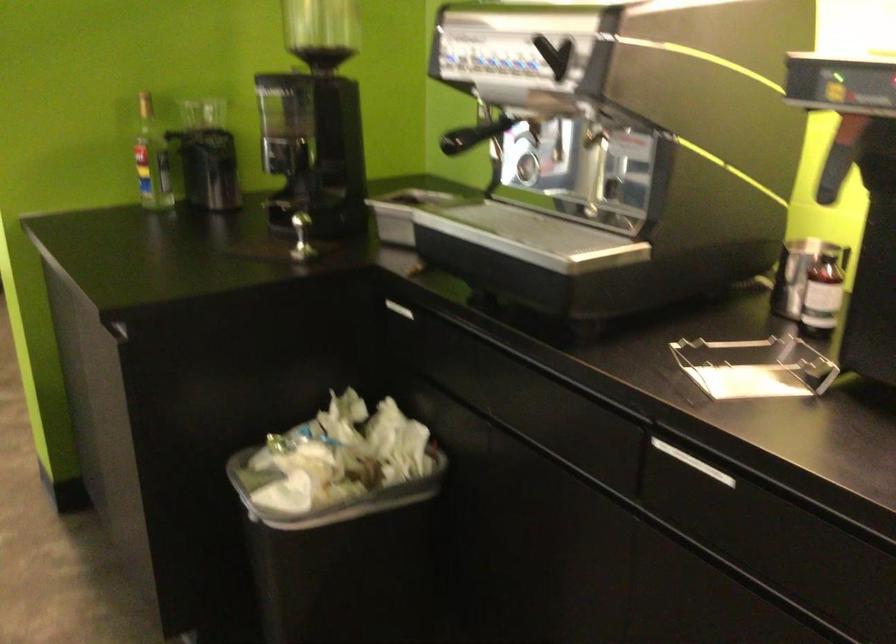
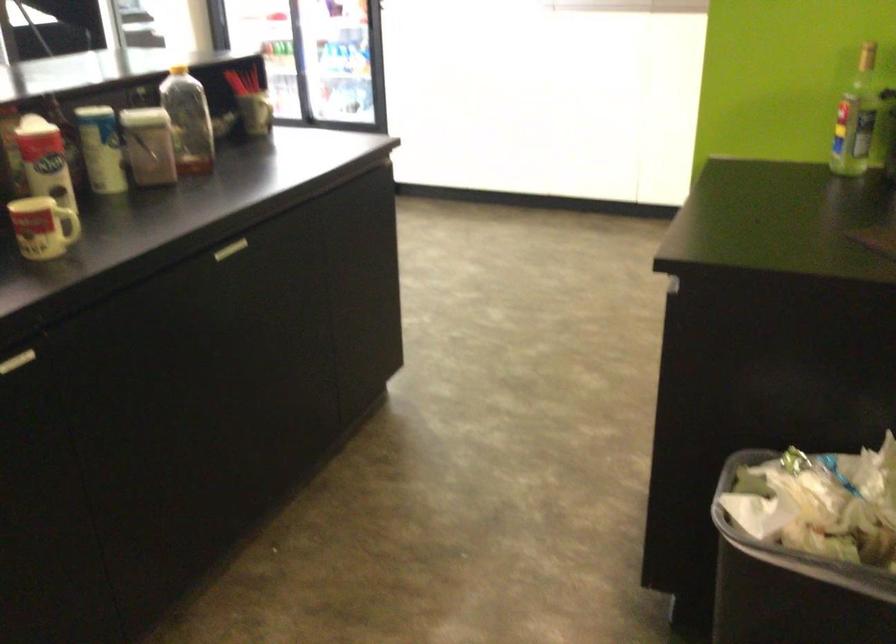
Question: Based on the continuous images, in which direction is the camera rotating? Reply with the corresponding letter.

Choices:
 (A) Left
 (B) Right
 (C) Up
 (D) Down

Answer: (A)